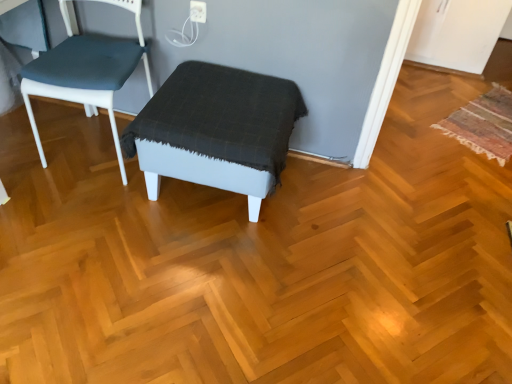
Locate an element on the screen. free space on the front side of matte gray stool at center is located at coordinates (197, 284).